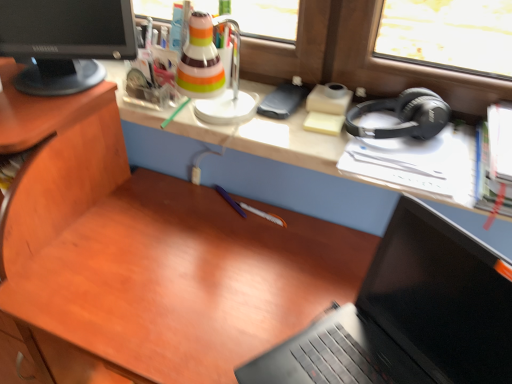
Question: Considering their positions, is black matte laptop at lower right located in front of or behind black matte headphones at right?

Choices:
 (A) behind
 (B) front

Answer: (B)

Question: Is point (346, 329) positioned closer to the camera than point (435, 107)?

Choices:
 (A) closer
 (B) farther

Answer: (A)

Question: Which is farther from the black matte laptop at lower right?

Choices:
 (A) black matte headphones at right
 (B) black glossy computer monitor at upper left

Answer: (B)

Question: Which of these objects is positioned closest to the black matte laptop at lower right?

Choices:
 (A) black matte headphones at right
 (B) black glossy computer monitor at upper left

Answer: (A)